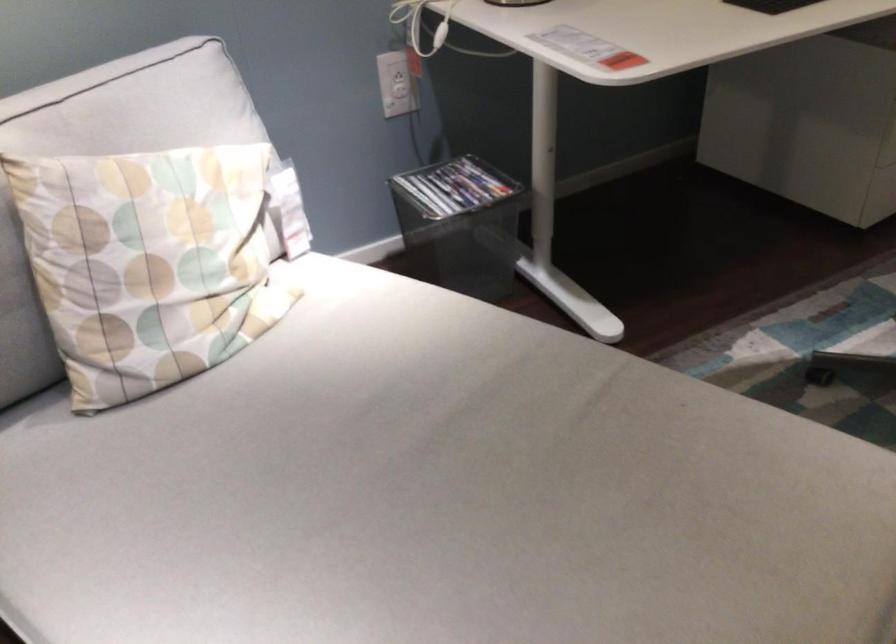
Where would you sit the sofa sitting surface? Please return your answer as a coordinate pair (x, y).

(438, 495)